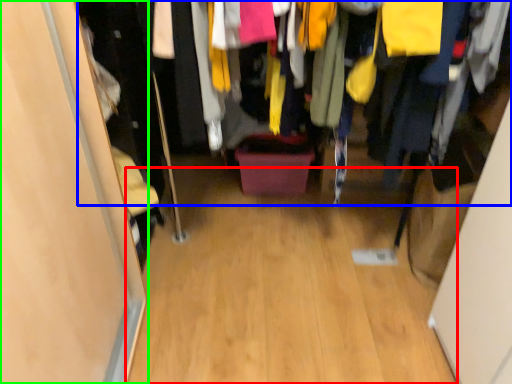
Question: Based on their relative distances, which object is nearer to plain (highlighted by a red box)? Choose from closet (highlighted by a blue box) and door (highlighted by a green box).

Choices:
 (A) closet
 (B) door

Answer: (B)